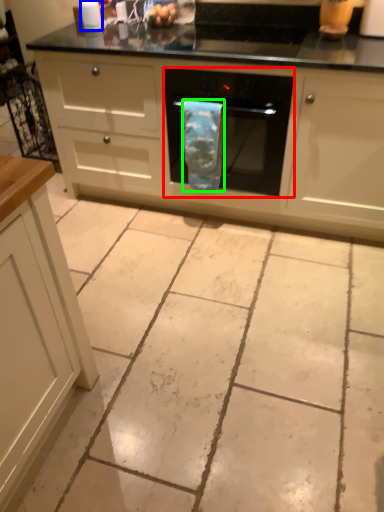
Question: Considering the real-world distances, which object is farthest from home appliance (highlighted by a red box)? kitchen appliance (highlighted by a blue box) or material (highlighted by a green box)?

Choices:
 (A) kitchen appliance
 (B) material

Answer: (A)